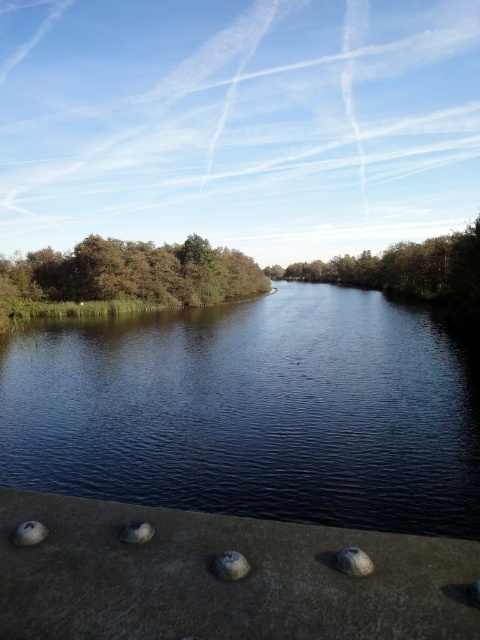
Question: Does white matte stone at lower left appear under gray matte stone at lower left?

Choices:
 (A) no
 (B) yes

Answer: (B)

Question: Does green leafy trees at left have a smaller size compared to white matte stone at lower left?

Choices:
 (A) yes
 (B) no

Answer: (B)

Question: Which point is closer to the camera taking this photo?

Choices:
 (A) pos(347,563)
 (B) pos(128,524)
 (C) pos(244,292)

Answer: (A)

Question: Which object appears closest to the camera in this image?

Choices:
 (A) green leafy trees at left
 (B) gray matte stone at lower left
 (C) white matte stone at lower left
 (D) gray matte stone at lower right

Answer: (D)

Question: Is smooth gray stone at lower center to the right of gray matte stone at lower right from the viewer's perspective?

Choices:
 (A) no
 (B) yes

Answer: (A)

Question: Which object is the closest to the green leafy tree at center?

Choices:
 (A) gray matte stone at lower left
 (B) dark blue water at center
 (C) smooth gray stone at lower center

Answer: (B)